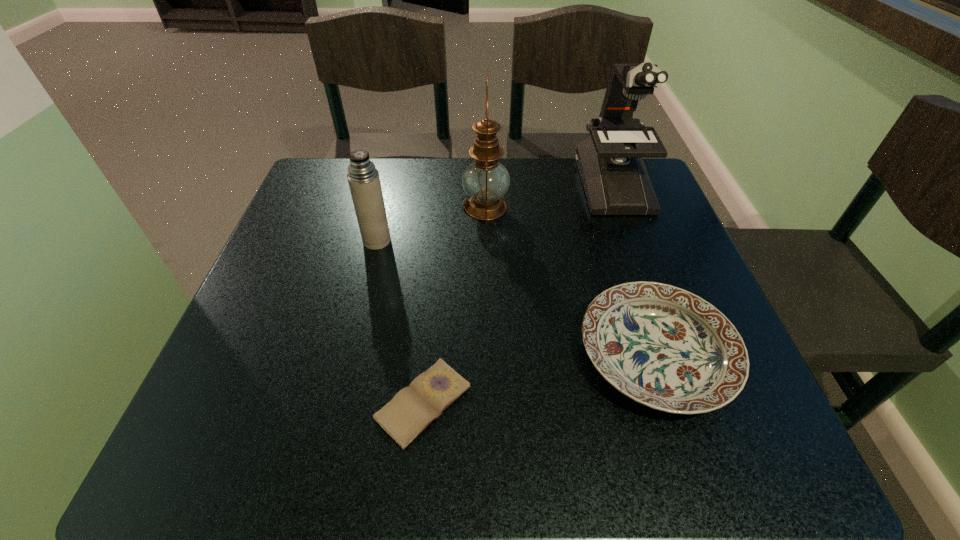
Locate an element on the screen. Image resolution: width=960 pixels, height=540 pixels. microscope is located at coordinates (610, 161).

The height and width of the screenshot is (540, 960). In order to click on oil lamp in this screenshot , I will do point(486,181).

I want to click on the leftmost object, so (x=363, y=178).

Find the location of a particular element. Image resolution: width=960 pixels, height=540 pixels. thermos bottle is located at coordinates (363, 178).

Find the location of a particular element. This screenshot has height=540, width=960. the second shortest object is located at coordinates (664, 347).

Locate an element on the screen. The height and width of the screenshot is (540, 960). the shortest object is located at coordinates (412, 409).

You are a GUI agent. You are given a task and a screenshot of the screen. Output one action in this format:
    pyautogui.click(x=<x>, y=<y>)
    Task: Click on the vacant space located 0.360m through the eyepieces of the microscope
    
    Given the screenshot: What is the action you would take?
    pyautogui.click(x=669, y=342)

Where is `vacant space located 0.140m on the left of the oil lamp`? This screenshot has width=960, height=540. vacant space located 0.140m on the left of the oil lamp is located at coordinates (404, 207).

This screenshot has height=540, width=960. In order to click on vacant space located 0.290m on the right of the thermos bottle in this screenshot , I will do `click(522, 241)`.

Where is `free space located on the back of the plate`? free space located on the back of the plate is located at coordinates (619, 246).